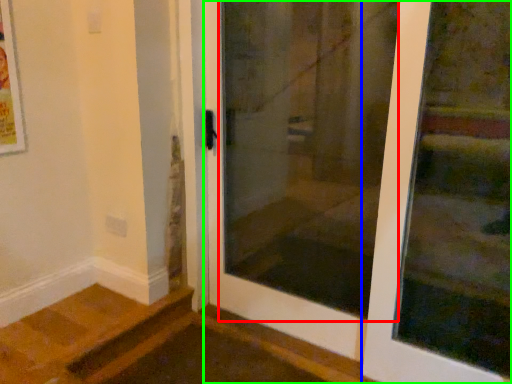
Question: Which object is positioned closest to screen door (highlighted by a red box)? Select from door (highlighted by a blue box) and door (highlighted by a green box).

Choices:
 (A) door
 (B) door

Answer: (B)